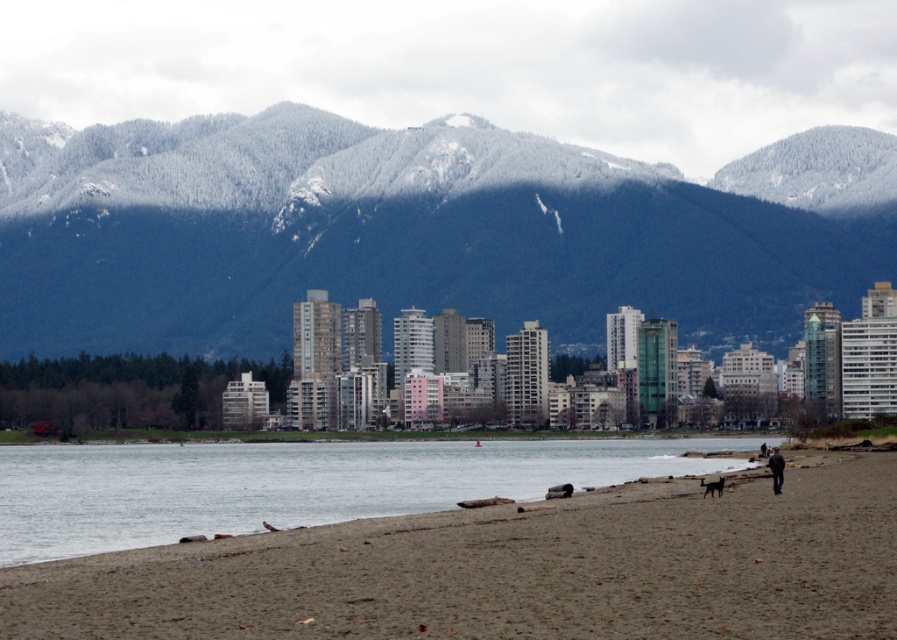
Consider the image. You are a photographer standing at the beach and want to capture the snowy forested mountain at upper center in your photo. The camera you have can focus on objects up to 2000 feet away. Will the mountain be in focus?

The snowy forested mountain at upper center is 2135.67 feet away from the camera, which is beyond the camera maximum focus range of 2000 feet. Therefore, the mountain will not be in focus.

You are standing on the beach looking towards the city. You see the snowy forested mountain at upper center and the dark blue jacket at lower right. Which object is higher in the image?

The snowy forested mountain at upper center is higher in the image than the dark blue jacket at lower right because it is located above it.